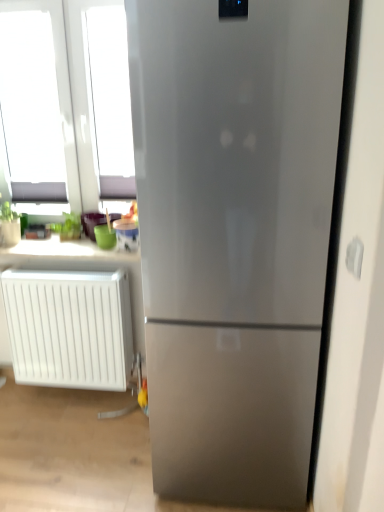
Question: Choose the correct answer: Is white plastic radiator at lower left inside white plastic electric outlet at right or outside it?

Choices:
 (A) outside
 (B) inside

Answer: (A)

Question: Looking at the image, does white plastic radiator at lower left seem bigger or smaller compared to white plastic electric outlet at right?

Choices:
 (A) small
 (B) big

Answer: (B)

Question: Which is nearer to the white plastic radiator at lower left?

Choices:
 (A) matte white counter top at upper left
 (B) white plastic electric outlet at right

Answer: (A)

Question: Estimate the real-world distances between objects in this image. Which object is farther from the white plastic radiator at lower left?

Choices:
 (A) white plastic electric outlet at right
 (B) matte white counter top at upper left

Answer: (A)